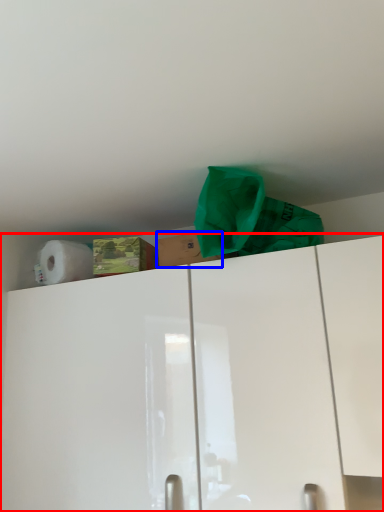
Question: Which point is further to the camera, cabinetry (highlighted by a red box) or cardboard box (highlighted by a blue box)?

Choices:
 (A) cabinetry
 (B) cardboard box

Answer: (B)